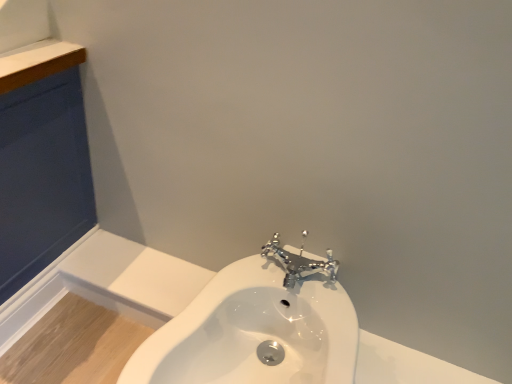
In order to face white glossy sink at center, should I rotate leftwards or rightwards?

You should rotate left by 0.852 degrees.

Image resolution: width=512 pixels, height=384 pixels. Describe the element at coordinates (253, 332) in the screenshot. I see `white glossy sink at center` at that location.

Find the location of a particular element. The height and width of the screenshot is (384, 512). white glossy sink at center is located at coordinates (253, 332).

This screenshot has height=384, width=512. Find the location of `white glossy sink at center`. white glossy sink at center is located at coordinates pyautogui.click(x=253, y=332).